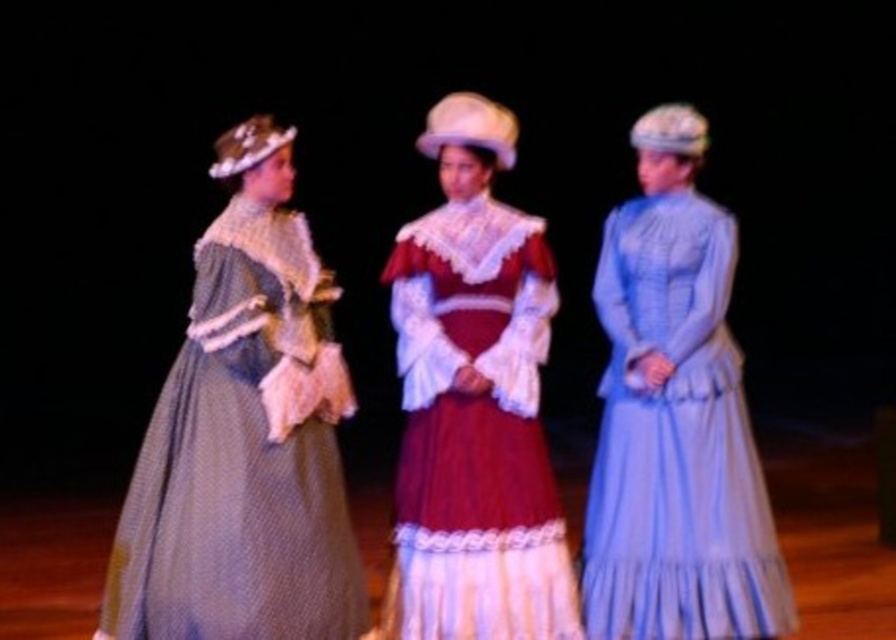
You are an audience member sitting in the front row of the stage. You notice two points marked in the image. Which point, point (681, 593) or point (478, 129), is closer to you?

Point (681, 593) is closer to the viewer than point (478, 129).

You are an audience member sitting in the front row of the stage. You notice two points marked in the image. Which point, point (102,637) or point (659,301), is closer to you?

Point (102,637) is closer to the viewer than point (659,301).